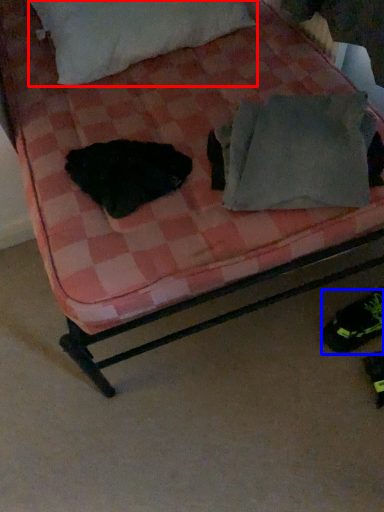
Question: Which object is closer to the camera taking this photo, pillow (highlighted by a red box) or footwear (highlighted by a blue box)?

Choices:
 (A) pillow
 (B) footwear

Answer: (B)